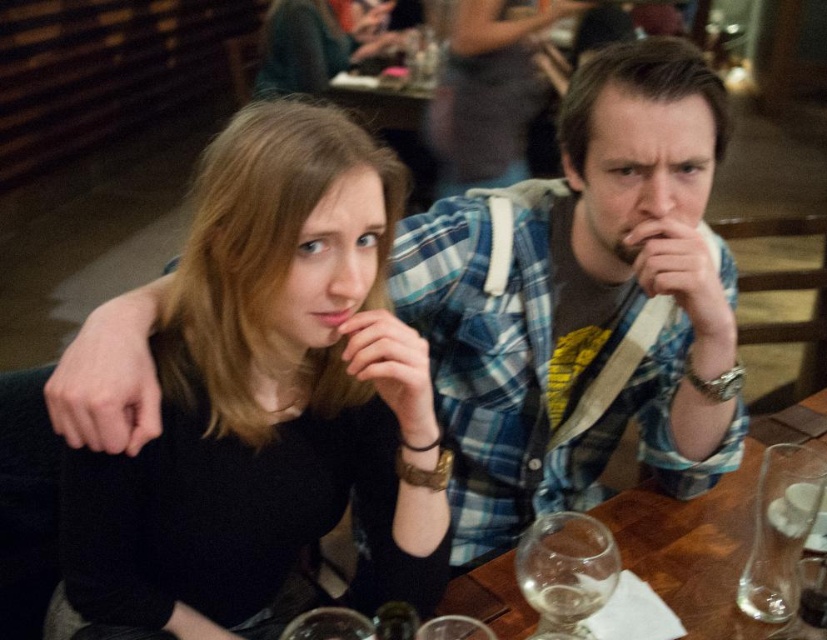
You are a server in a restaurant and need to place a new menu on the table between the black matte shirt at center and the transparent glass at lower right. Can you fit the menu there if the menu is 12 inches wide?

The black matte shirt at center might be wider than transparent glass at lower right, so it is uncertain if there is enough space to fit a 12 inch wide menu between them. Check the actual distance before placing it.

You are a server at the restaurant and need to place a 30 cm wide decorative plate between the wooden table at center and the transparent glass wine glass at lower center. Will there be enough space to fit it without moving either object?

The distance between the wooden table at center and the transparent glass wine glass at lower center is 25.20 centimeters. Since the decorative plate is 30 cm wide, it will not fit in the available space.

You are standing in front of a restaurant table where two people are sitting. You need to place a small vase between the two points labeled as point (197, 417) and point (811, 474). Which point should the vase be closer to if you want it to appear closer to you?

The vase should be placed closer to point (197, 417) because it is closer to the viewer than point (811, 474).